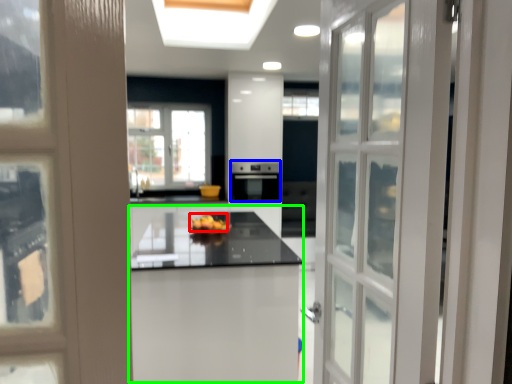
Question: Which object is positioned closest to fruit (highlighted by a red box)? Select from appliance (highlighted by a blue box) and table (highlighted by a green box).

Choices:
 (A) appliance
 (B) table

Answer: (B)